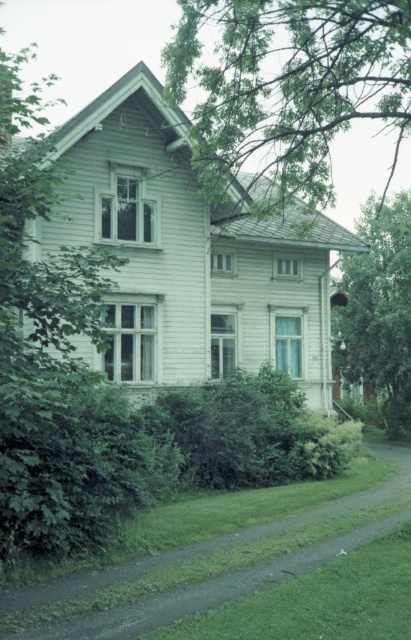
You are standing at the entrance of the two story wooden house and see two points marked on the path in front of you. The first point is at coordinate point (277, 202) and the second point is at coordinate point (376, 529). Which point is closer to you as you stand at the entrance?

Point (277, 202) is further to the camera than point (376, 529). Therefore, the point closer to you is point (376, 529).

You are standing at the entrance of the two story wooden house and want to walk to the point marked as point (343, 362). However, there is an obstacle at point marked as point (408, 483). Will you encounter this obstacle before reaching your destination?

Yes, you will encounter the obstacle at point (408, 483) before reaching your destination at point (343, 362) because point (408, 483) is closer to the viewer than point (343, 362).